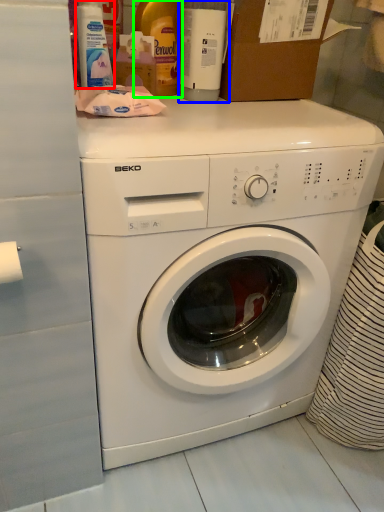
Question: Based on their relative distances, which object is farther from cleaning product (highlighted by a red box)? Choose from bottle (highlighted by a blue box) and bottle (highlighted by a green box).

Choices:
 (A) bottle
 (B) bottle

Answer: (A)